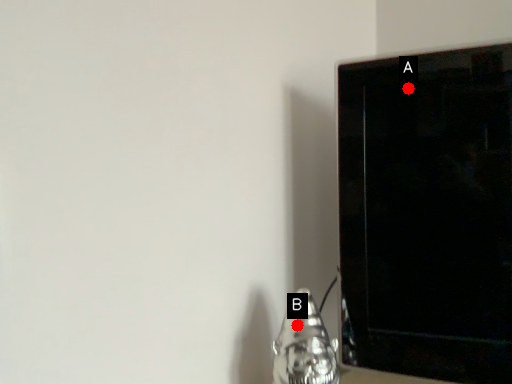
Question: Two points are circled on the image, labeled by A and B beside each circle. Which point is farther to the camera?

Choices:
 (A) A is further
 (B) B is further

Answer: (A)